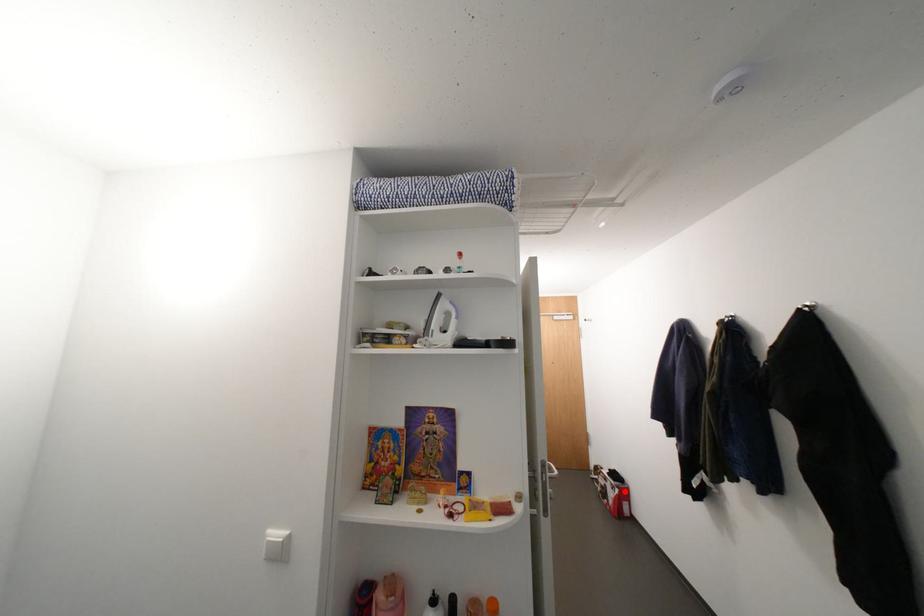
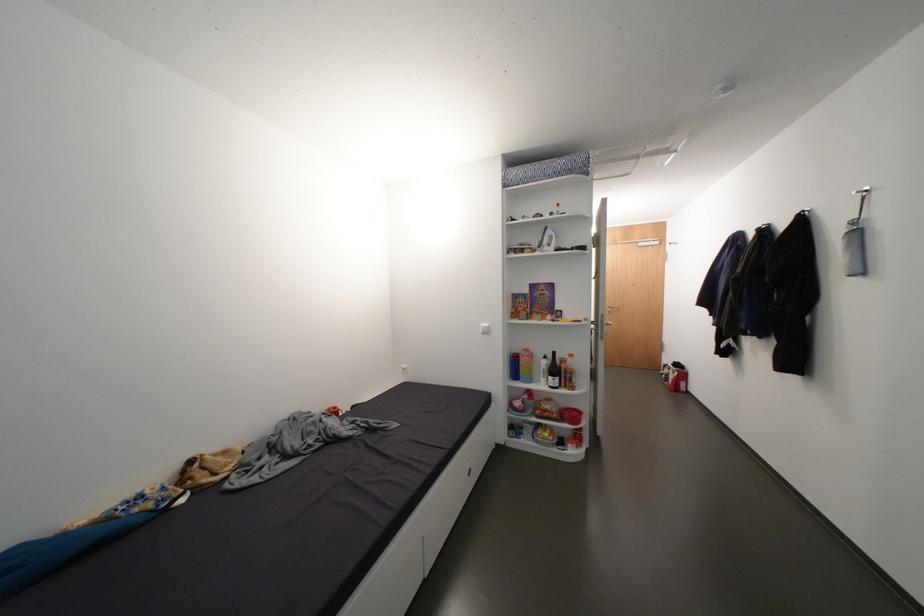
Question: I am providing you with two images of the same scene from different viewpoints. In image1, a red point is highlighted. Considering the same 3D point in image2, which of the following is correct?

Choices:
 (A) It is closer
 (B) It is farther

Answer: (A)